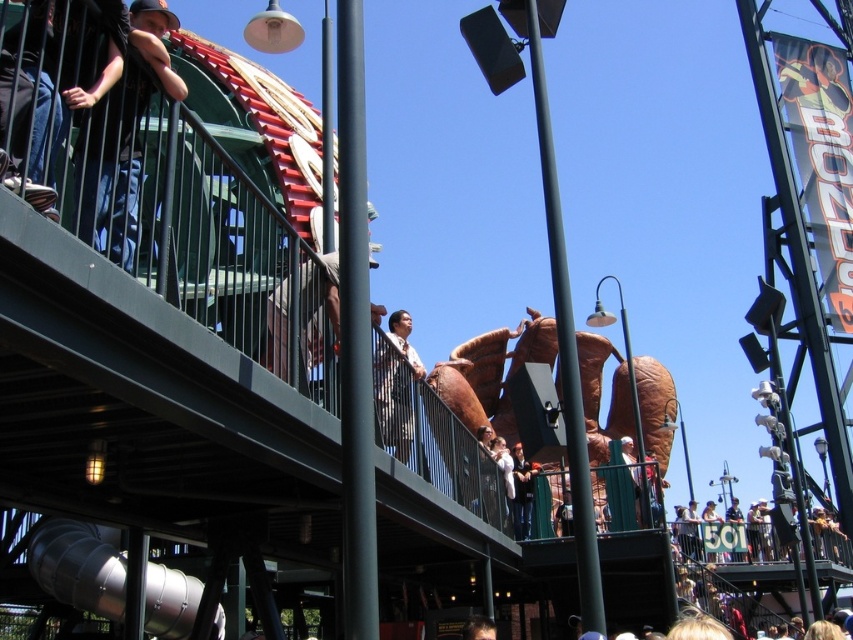
You are a photographer at the event and want to capture both the light brown shirt at center and the white cotton jacket at center in a single shot. Which clothing item should you focus on first to ensure both are in frame?

The light brown shirt at center is located above the white cotton jacket at center, so focusing on the light brown shirt at center first will allow you to adjust the camera angle downward to include the white cotton jacket at center in the shot.

Looking at this image, you are at an outdoor event and see two people wearing a light brown shirt at center and a white cotton jacket at center. Which one is positioned to the left?

The light brown shirt at center is positioned to the left of the white cotton jacket at center.